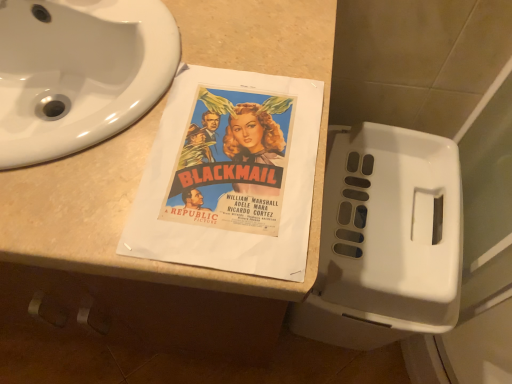
Question: In terms of height, does white plastic toilet at right look taller or shorter compared to beige laminate counter top at center?

Choices:
 (A) short
 (B) tall

Answer: (A)

Question: From the image's perspective, is white plastic toilet at right above or below beige laminate counter top at center?

Choices:
 (A) above
 (B) below

Answer: (B)

Question: Estimate the real-world distances between objects in this image. Which object is farther from the white plastic toilet at right?

Choices:
 (A) beige laminate counter top at center
 (B) white glossy sink at upper left

Answer: (B)

Question: Estimate the real-world distances between objects in this image. Which object is farther from the white plastic toilet at right?

Choices:
 (A) white glossy sink at upper left
 (B) beige laminate counter top at center

Answer: (A)